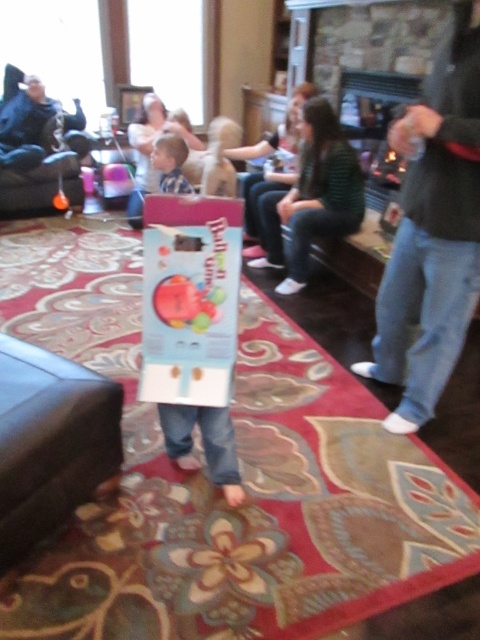
Which is in front, point (409, 346) or point (178, 182)?

Point (409, 346)

Is the position of jeans at center less distant than that of light brown hair at center?

Yes, jeans at center is closer to the viewer.

You are a GUI agent. You are given a task and a screenshot of the screen. Output one action in this format:
    pyautogui.click(x=<x>, y=<y>)
    Task: Click on the jeans at center
    This screenshot has width=480, height=640.
    Given the screenshot: What is the action you would take?
    pyautogui.click(x=432, y=230)

The image size is (480, 640). I want to click on jeans at center, so click(x=432, y=230).